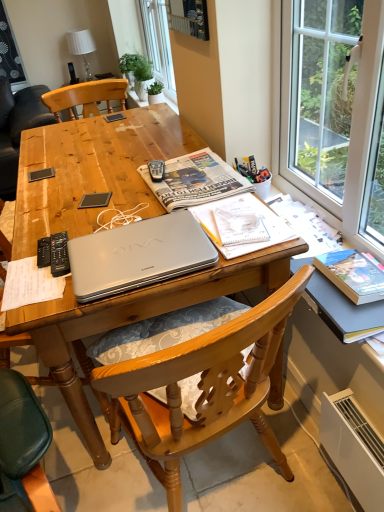
You are a GUI agent. You are given a task and a screenshot of the screen. Output one action in this format:
    pyautogui.click(x=<x>, y=<y>)
    Task: Click on the vacant space situated on the left part of silver metallic laptop at center
    Image resolution: width=384 pixels, height=512 pixels.
    Given the screenshot: What is the action you would take?
    pyautogui.click(x=40, y=261)